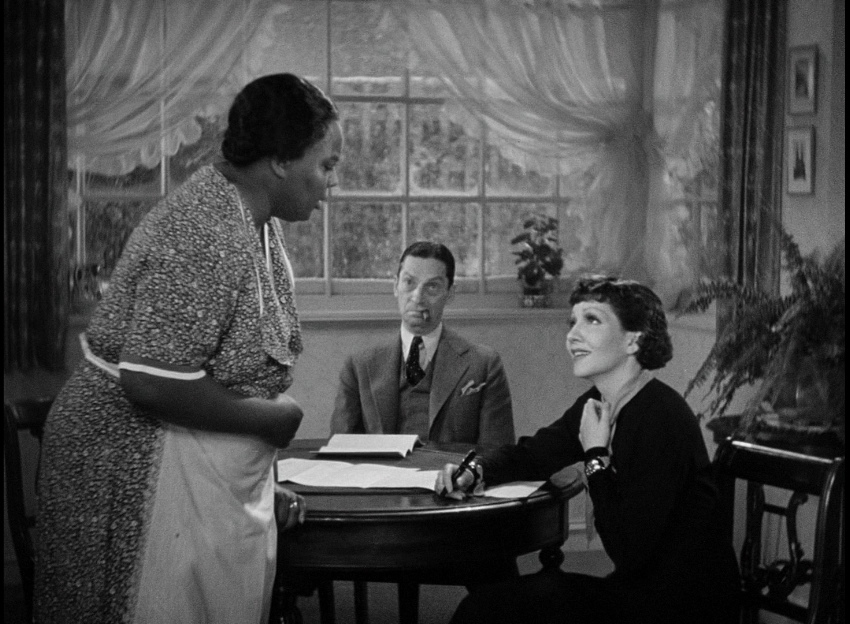
You are a GUI agent. You are given a task and a screenshot of the screen. Output one action in this format:
    pyautogui.click(x=<x>, y=<y>)
    Task: Click on the floor
    This screenshot has height=624, width=850.
    Given the screenshot: What is the action you would take?
    pyautogui.click(x=416, y=608)